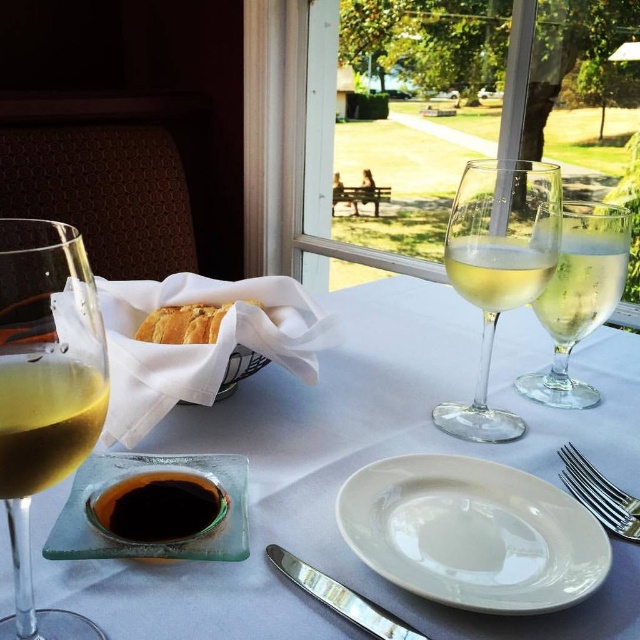
Between clear glass wine glass at center and green grass at upper center, which one is positioned higher?

green grass at upper center is higher up.

Looking at this image, can you confirm if clear glass wine glass at center is shorter than green grass at upper center?

Indeed, clear glass wine glass at center has a lesser height compared to green grass at upper center.

Between point (449, 260) and point (346, 196), which one is positioned in front?

Point (449, 260)

Where is `clear glass wine glass at center`? Image resolution: width=640 pixels, height=640 pixels. clear glass wine glass at center is located at coordinates (499, 268).

Measure the distance from white glossy plate at center to clear glass wine glass at center.

white glossy plate at center and clear glass wine glass at center are 4.84 inches apart from each other.

Is the position of white glossy plate at center more distant than that of clear glass wine glass at center?

No.

Image resolution: width=640 pixels, height=640 pixels. What do you see at coordinates (472, 532) in the screenshot? I see `white glossy plate at center` at bounding box center [472, 532].

The width and height of the screenshot is (640, 640). I want to click on white glossy plate at center, so click(x=472, y=532).

Which of these two, green grass at upper center or transparent glass ashtray at center, stands taller?

Standing taller between the two is green grass at upper center.

Which is below, green grass at upper center or transparent glass ashtray at center?

transparent glass ashtray at center

Is point (440, 204) more distant than point (138, 540)?

Yes, it is.

Find the location of a particular element. The width and height of the screenshot is (640, 640). green grass at upper center is located at coordinates (403, 180).